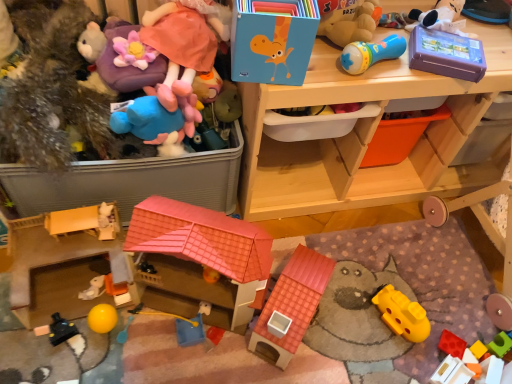
Question: From the image's perspective, is white plush toy at lower left, the twelfth toy from the right, located above or below rubberized plastic microphone at upper right, which is the 11th toy from left to right?

Choices:
 (A) above
 (B) below

Answer: (B)

Question: From a real-world perspective, relative to rubberized plastic microphone at upper right, arranged as the fourth toy when viewed from the right, is white plush toy at lower left, the third toy positioned from the left, vertically above or below?

Choices:
 (A) above
 (B) below

Answer: (B)

Question: Considering the real-world distances, which object is farthest from the purple plastic case at upper right, the second storage box when ordered from left to right?

Choices:
 (A) matte blue plush at upper left, the 8th toy in the right-to-left sequence
 (B) fuzzy brown teddy bear at left, the first toy when ordered from left to right
 (C) blue plastic toy at center, the 8th toy viewed from the left
 (D) wooden toy storage at upper center
 (E) rubberized red block at lower right, which appears as the 2th toy when viewed from the right

Answer: (C)

Question: Which of these objects is positioned closest to the matte plastic toy house at lower left, which is counted as the tenth toy, starting from the right?

Choices:
 (A) rubberized red block at lower right, the thirteenth toy viewed from the left
 (B) black plastic toy at lower left, the 13th toy viewed from the right
 (C) white plush toy at lower left, the twelfth toy from the right
 (D) fluffy plush at upper left, which appears as the 6th toy when viewed from the right
 (E) yellow rubber ball at lower left, acting as the 11th toy starting from the right

Answer: (D)